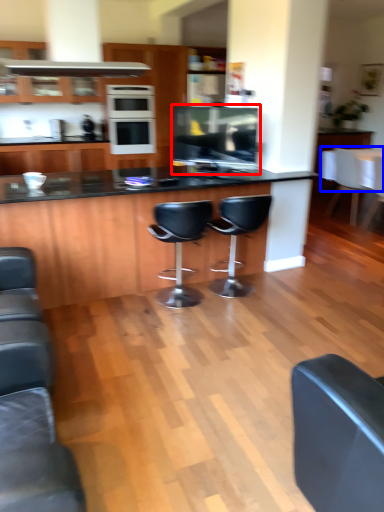
Question: Which of the following is the farthest to the observer, appliance (highlighted by a red box) or counter top (highlighted by a blue box)?

Choices:
 (A) appliance
 (B) counter top

Answer: (B)